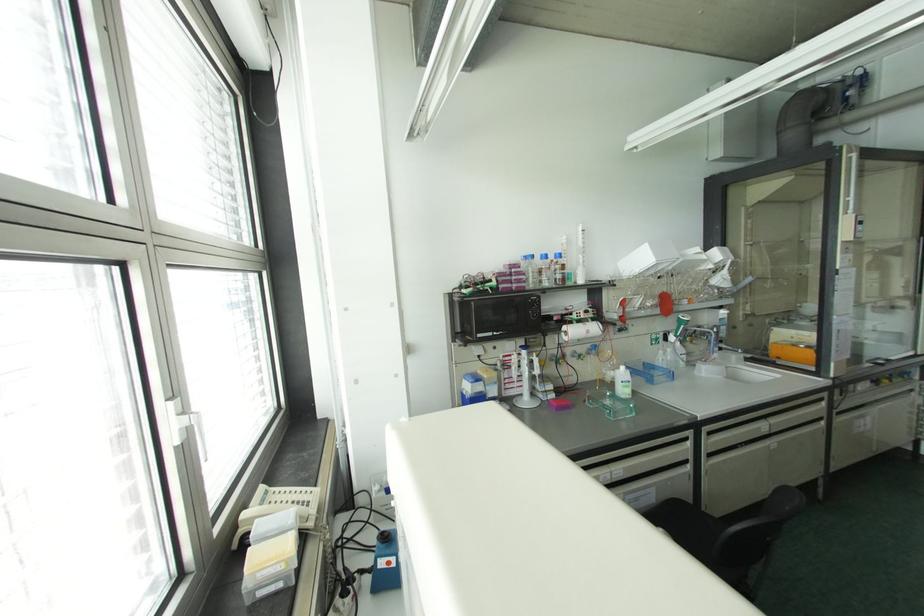
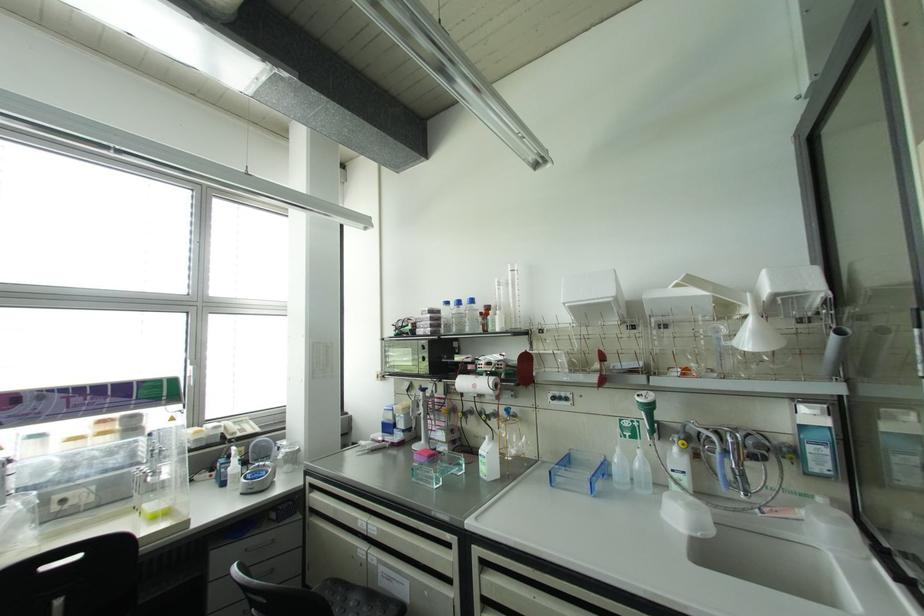
Find the pixel in the second image that matches (x=558, y=254) in the first image.

(471, 301)